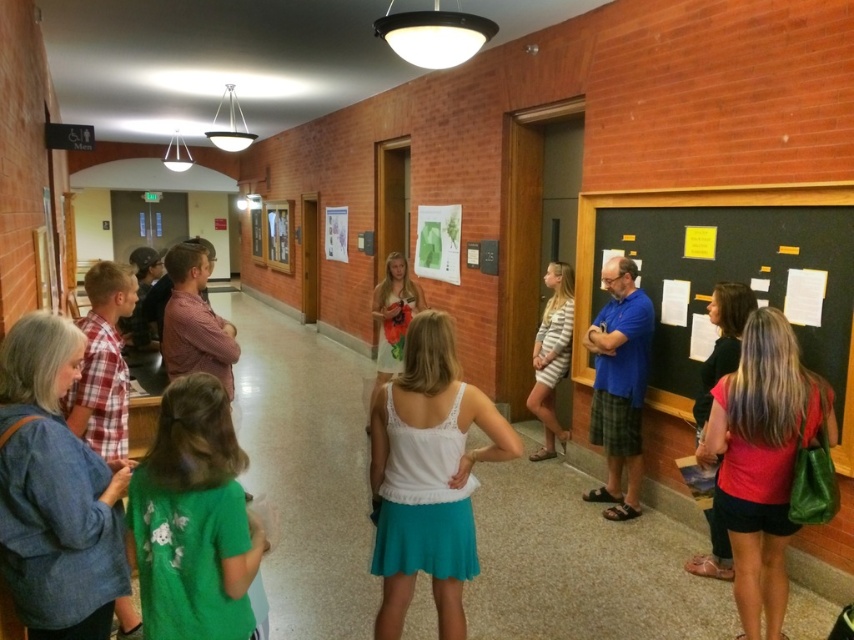
Question: Considering the relative positions of white lace tank top at center and green cotton shirt at lower left in the image provided, where is white lace tank top at center located with respect to green cotton shirt at lower left?

Choices:
 (A) right
 (B) left

Answer: (A)

Question: Can you confirm if white lace tank top at center is thinner than pink fabric dress at lower right?

Choices:
 (A) no
 (B) yes

Answer: (A)

Question: Which point is farther from the camera taking this photo?

Choices:
 (A) (728, 486)
 (B) (702, 573)
 (C) (592, 436)

Answer: (C)

Question: Which of these objects is positioned farthest from the black matte chalkboard at right?

Choices:
 (A) white lace tank top at center
 (B) blue plaid shorts at center
 (C) pink fabric dress at lower right

Answer: (A)

Question: Is matte red shirt at right positioned in front of black matte chalkboard at right?

Choices:
 (A) no
 (B) yes

Answer: (B)

Question: Which point is closer to the camera taking this photo?

Choices:
 (A) (770, 339)
 (B) (723, 193)
 (C) (730, 285)
 (D) (617, 326)

Answer: (A)